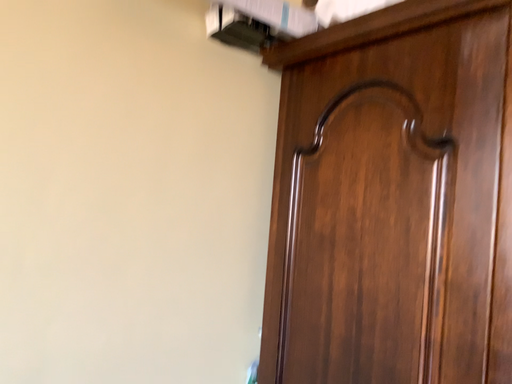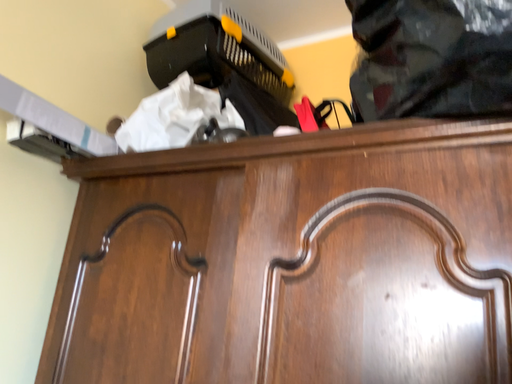
Question: Which way did the camera rotate in the video?

Choices:
 (A) rotated left
 (B) rotated right

Answer: (B)